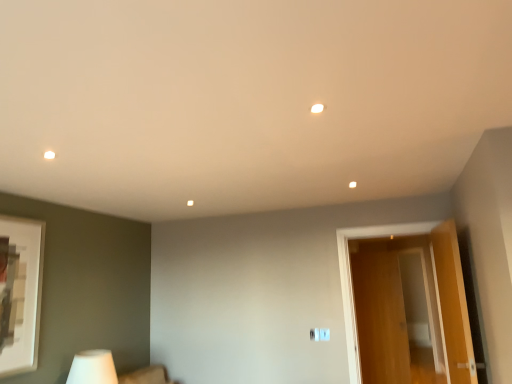
Question: From the image's perspective, would you say white matte table lamp at lower left is positioned over wooden door at right?

Choices:
 (A) no
 (B) yes

Answer: (A)

Question: Does white matte table lamp at lower left have a lesser width compared to wooden door at right?

Choices:
 (A) yes
 (B) no

Answer: (B)

Question: Does white matte table lamp at lower left have a smaller size compared to wooden door at right?

Choices:
 (A) no
 (B) yes

Answer: (B)

Question: Considering the relative sizes of white matte table lamp at lower left and wooden door at right in the image provided, is white matte table lamp at lower left wider than wooden door at right?

Choices:
 (A) no
 (B) yes

Answer: (B)

Question: Can you confirm if white matte table lamp at lower left is taller than wooden door at right?

Choices:
 (A) no
 (B) yes

Answer: (A)

Question: Does white matte table lamp at lower left contain wooden door at right?

Choices:
 (A) no
 (B) yes

Answer: (A)

Question: Does wooden door at right have a lesser width compared to white matte table lamp at lower left?

Choices:
 (A) yes
 (B) no

Answer: (A)

Question: Does wooden door at right come behind white matte table lamp at lower left?

Choices:
 (A) no
 (B) yes

Answer: (B)

Question: From a real-world perspective, does wooden door at right sit lower than white matte table lamp at lower left?

Choices:
 (A) no
 (B) yes

Answer: (A)

Question: From the image's perspective, would you say wooden door at right is positioned over white matte table lamp at lower left?

Choices:
 (A) no
 (B) yes

Answer: (B)

Question: Is white matte table lamp at lower left located within wooden door at right?

Choices:
 (A) yes
 (B) no

Answer: (B)

Question: Does wooden door at right lie in front of white matte table lamp at lower left?

Choices:
 (A) no
 (B) yes

Answer: (A)

Question: From a real-world perspective, relative to wooden door at right, is white matte table lamp at lower left vertically above or below?

Choices:
 (A) below
 (B) above

Answer: (A)